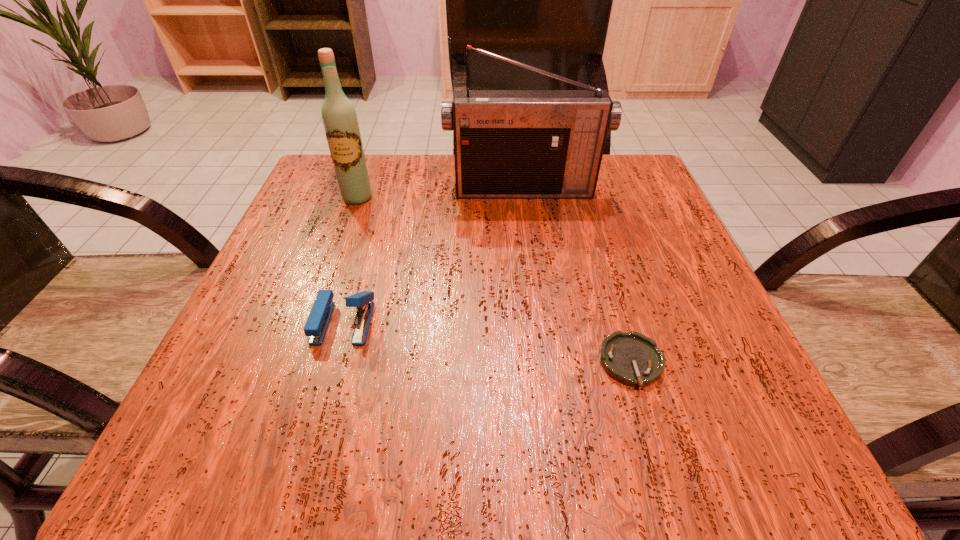
Find the location of a particular element. The height and width of the screenshot is (540, 960). free spot between the ashtray and the radio receiver is located at coordinates (577, 276).

Find the location of a particular element. empty location between the radio receiver and the ashtray is located at coordinates 577,276.

Image resolution: width=960 pixels, height=540 pixels. I want to click on vacant area that lies between the stapler and the radio receiver, so click(434, 255).

Locate an element on the screen. object that stands as the second closest to the shortest object is located at coordinates (508, 144).

Identify which object is the closest to the wine bottle. Please provide its 2D coordinates. Your answer should be formatted as a tuple, i.e. [(x, y)], where the tuple contains the x and y coordinates of a point satisfying the conditions above.

[(508, 144)]

At what (x,y) coordinates should I click in order to perform the action: click on vacant space that satisfies the following two spatial constraints: 1. on the front-facing side of the radio receiver; 2. on the right side of the ashtray. Please return your answer as a coordinate pair (x, y). This screenshot has height=540, width=960. Looking at the image, I should click on (546, 362).

This screenshot has height=540, width=960. Find the location of `vacant space that satisfies the following two spatial constraints: 1. on the front-facing side of the second shortest object; 2. on the right side of the wine bottle`. vacant space that satisfies the following two spatial constraints: 1. on the front-facing side of the second shortest object; 2. on the right side of the wine bottle is located at coordinates (314, 322).

This screenshot has height=540, width=960. Find the location of `free spot that satisfies the following two spatial constraints: 1. on the front-facing side of the third tallest object; 2. on the right side of the wine bottle`. free spot that satisfies the following two spatial constraints: 1. on the front-facing side of the third tallest object; 2. on the right side of the wine bottle is located at coordinates (314, 322).

You are a GUI agent. You are given a task and a screenshot of the screen. Output one action in this format:
    pyautogui.click(x=<x>, y=<y>)
    Task: Click on the free space that satisfies the following two spatial constraints: 1. on the front-facing side of the ashtray; 2. on the right side of the radio receiver
    This screenshot has height=540, width=960.
    Given the screenshot: What is the action you would take?
    pyautogui.click(x=546, y=362)

Find the location of a particular element. This screenshot has width=960, height=540. vacant space that satisfies the following two spatial constraints: 1. on the front-facing side of the wine bottle; 2. on the right side of the shortest object is located at coordinates (300, 362).